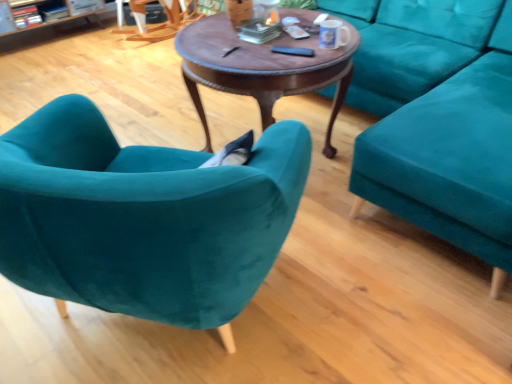
The width and height of the screenshot is (512, 384). I want to click on vacant space situated on the left part of wooden rocking chair at upper left, so click(x=92, y=44).